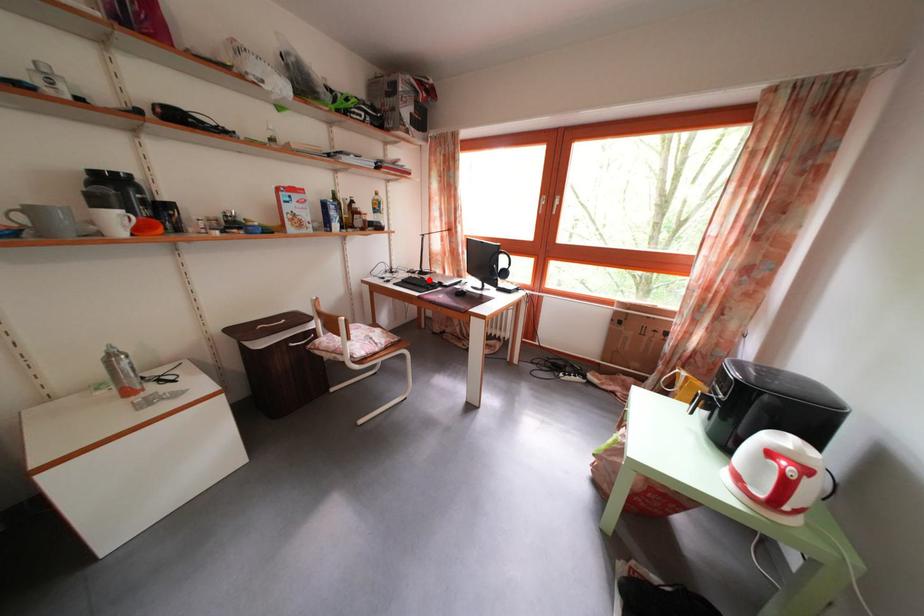
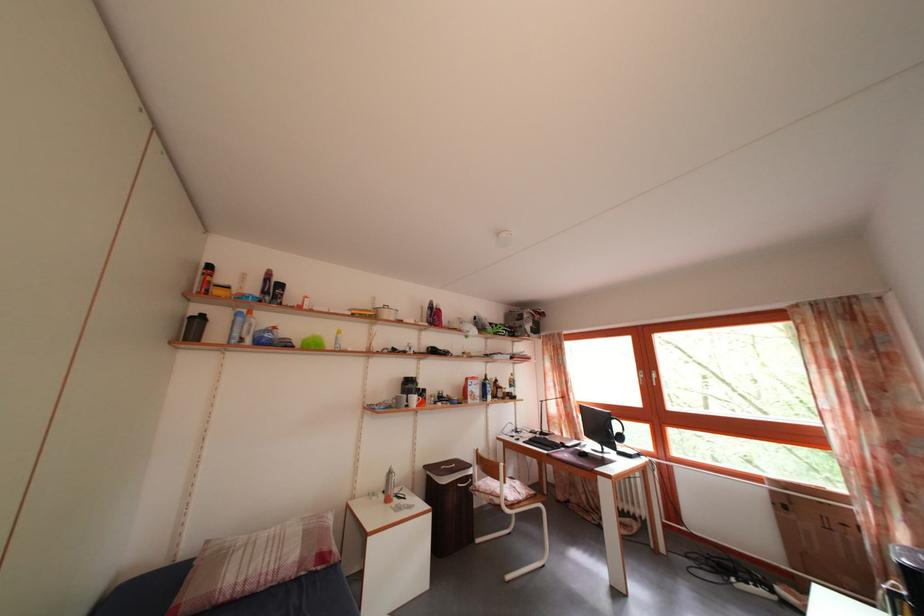
Question: I am providing you with two images of the same scene from different viewpoints. Given a red point in image1, look at the same physical point in image2. Is it:

Choices:
 (A) Closer to the viewpoint
 (B) Farther from the viewpoint

Answer: (B)